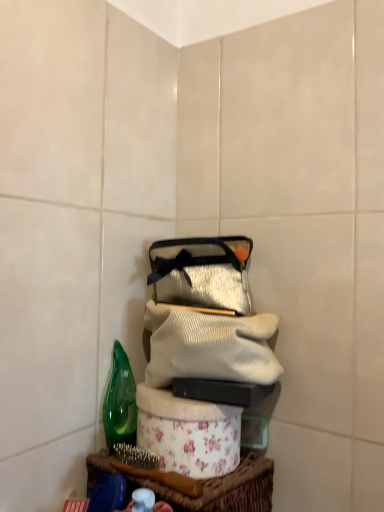
Question: Can we say white ribbed sweater at center lies outside shiny silver pouch at center?

Choices:
 (A) no
 (B) yes

Answer: (B)

Question: Is white ribbed sweater at center wider than shiny silver pouch at center?

Choices:
 (A) yes
 (B) no

Answer: (A)

Question: From the image's perspective, does white ribbed sweater at center appear lower than shiny silver pouch at center?

Choices:
 (A) no
 (B) yes

Answer: (B)

Question: Can you see white ribbed sweater at center touching shiny silver pouch at center?

Choices:
 (A) yes
 (B) no

Answer: (A)

Question: Considering the relative sizes of white ribbed sweater at center and shiny silver pouch at center in the image provided, is white ribbed sweater at center thinner than shiny silver pouch at center?

Choices:
 (A) yes
 (B) no

Answer: (B)

Question: Does point (206, 266) appear closer or farther from the camera than point (163, 350)?

Choices:
 (A) farther
 (B) closer

Answer: (A)

Question: Is shiny silver pouch at center bigger or smaller than white ribbed sweater at center?

Choices:
 (A) small
 (B) big

Answer: (A)

Question: From their relative heights in the image, would you say shiny silver pouch at center is taller or shorter than white ribbed sweater at center?

Choices:
 (A) short
 (B) tall

Answer: (B)

Question: From a real-world perspective, is shiny silver pouch at center above or below white ribbed sweater at center?

Choices:
 (A) above
 (B) below

Answer: (A)

Question: Considering the positions of floral fabric basket at lower center and shiny silver pouch at center in the image, is floral fabric basket at lower center wider or thinner than shiny silver pouch at center?

Choices:
 (A) wide
 (B) thin

Answer: (B)

Question: In the image, is floral fabric basket at lower center on the left side or the right side of shiny silver pouch at center?

Choices:
 (A) right
 (B) left

Answer: (B)

Question: Relative to shiny silver pouch at center, is floral fabric basket at lower center in front or behind?

Choices:
 (A) behind
 (B) front

Answer: (B)

Question: Is floral fabric basket at lower center spatially inside shiny silver pouch at center, or outside of it?

Choices:
 (A) inside
 (B) outside

Answer: (B)

Question: Based on their positions, is floral fabric basket at lower center located to the left or right of green glass bottle at left?

Choices:
 (A) right
 (B) left

Answer: (A)

Question: Would you say floral fabric basket at lower center is inside or outside green glass bottle at left?

Choices:
 (A) inside
 (B) outside

Answer: (B)